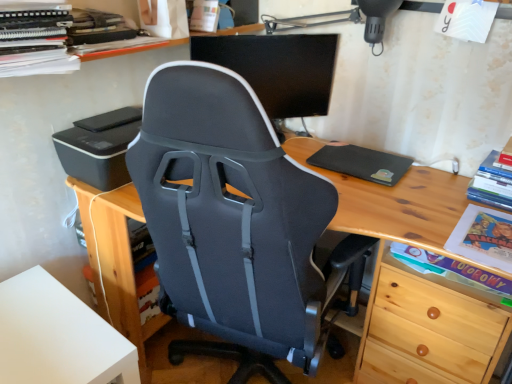
The image size is (512, 384). In order to click on vacant space positioned to the left of hardcover book at right, which appears as the third book when viewed from the left in this screenshot , I will do `click(453, 201)`.